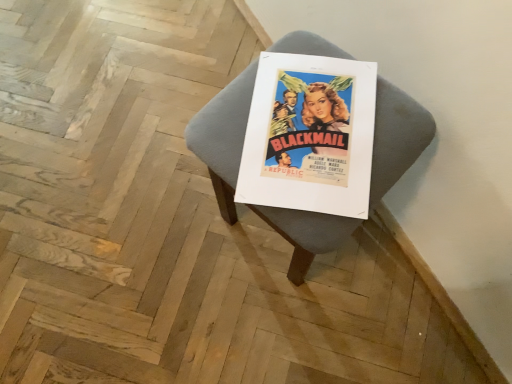
Question: Is the position of matte gray cushion at center more distant than that of matte paper poster at center?

Choices:
 (A) yes
 (B) no

Answer: (B)

Question: From a real-world perspective, does matte gray cushion at center stand above matte paper poster at center?

Choices:
 (A) yes
 (B) no

Answer: (B)

Question: Could matte paper poster at center be considered to be inside matte gray cushion at center?

Choices:
 (A) no
 (B) yes

Answer: (B)

Question: Can you confirm if matte gray cushion at center is taller than matte paper poster at center?

Choices:
 (A) no
 (B) yes

Answer: (B)

Question: From the image's perspective, is matte gray cushion at center located beneath matte paper poster at center?

Choices:
 (A) no
 (B) yes

Answer: (B)

Question: Does matte gray cushion at center have a lesser width compared to matte paper poster at center?

Choices:
 (A) no
 (B) yes

Answer: (A)

Question: Can you confirm if matte paper poster at center is smaller than matte gray cushion at center?

Choices:
 (A) no
 (B) yes

Answer: (B)

Question: From a real-world perspective, does matte paper poster at center stand above matte gray cushion at center?

Choices:
 (A) no
 (B) yes

Answer: (B)

Question: From a real-world perspective, does matte paper poster at center sit lower than matte gray cushion at center?

Choices:
 (A) no
 (B) yes

Answer: (A)

Question: Is matte paper poster at center not near matte gray cushion at center?

Choices:
 (A) no
 (B) yes

Answer: (A)

Question: Is matte paper poster at center looking in the opposite direction of matte gray cushion at center?

Choices:
 (A) yes
 (B) no

Answer: (A)

Question: Does matte paper poster at center turn towards matte gray cushion at center?

Choices:
 (A) yes
 (B) no

Answer: (A)

Question: Visually, is matte gray cushion at center positioned to the left or to the right of matte paper poster at center?

Choices:
 (A) left
 (B) right

Answer: (B)